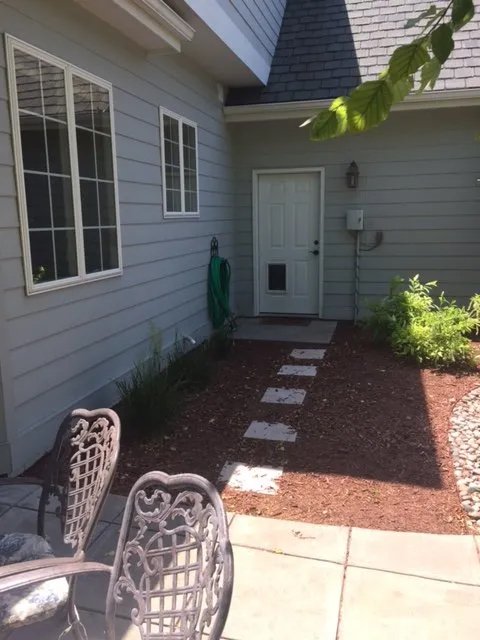
Identify the location of backs of the chairs. (93, 464), (176, 545).